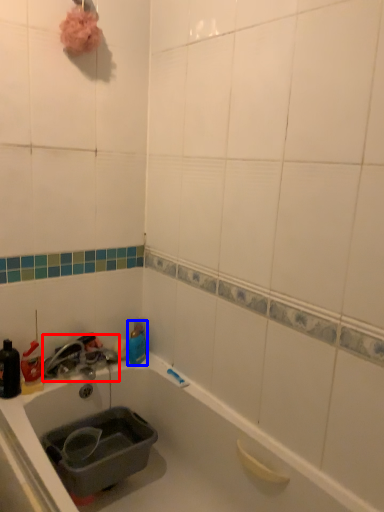
Question: Which object is closer to the camera taking this photo, faucet (highlighted by a red box) or bottle (highlighted by a blue box)?

Choices:
 (A) faucet
 (B) bottle

Answer: (A)